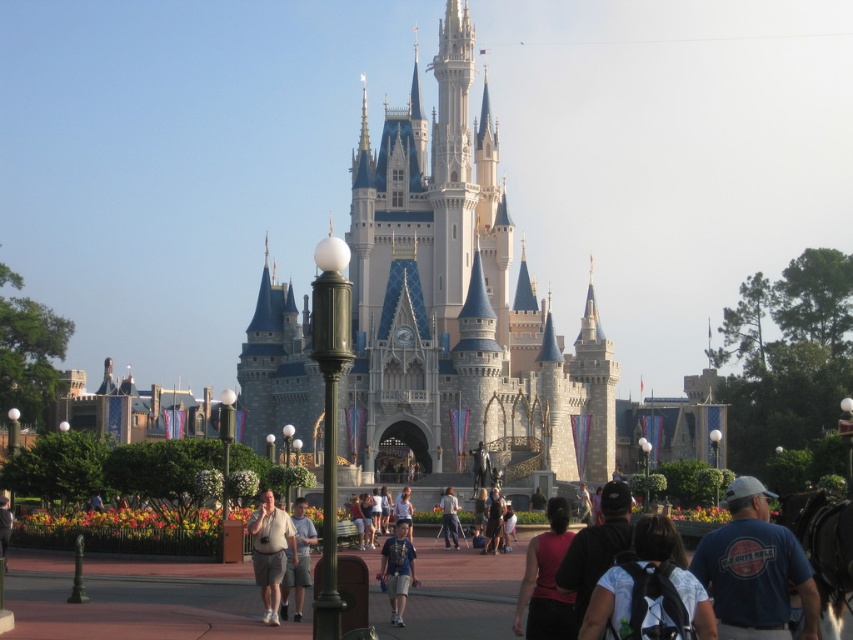
Which is behind, point (399, 540) or point (457, 532)?

Point (457, 532)

Describe the element at coordinates (397, 570) in the screenshot. I see `blue denim shorts at center` at that location.

Which is in front, point (393, 609) or point (442, 524)?

Point (393, 609) is in front.

Find the location of a particular element. This screenshot has height=640, width=853. blue denim shorts at center is located at coordinates (397, 570).

Describe the element at coordinates (546, 580) in the screenshot. I see `matte pink shirt at lower right` at that location.

Which is in front, point (548, 611) or point (402, 577)?

Positioned in front is point (548, 611).

Image resolution: width=853 pixels, height=640 pixels. I want to click on matte pink shirt at lower right, so click(x=546, y=580).

Looking at this image, is dark blue jeans at center positioned in front of light blue denim shorts at center?

Yes, it is.

Between point (502, 515) and point (450, 490), which one is positioned in front?

Point (502, 515) is in front.

You are a GUI agent. You are given a task and a screenshot of the screen. Output one action in this format:
    pyautogui.click(x=<x>, y=<y>)
    Task: Click on the dark blue jeans at center
    Image resolution: width=853 pixels, height=640 pixels.
    Given the screenshot: What is the action you would take?
    pyautogui.click(x=492, y=522)